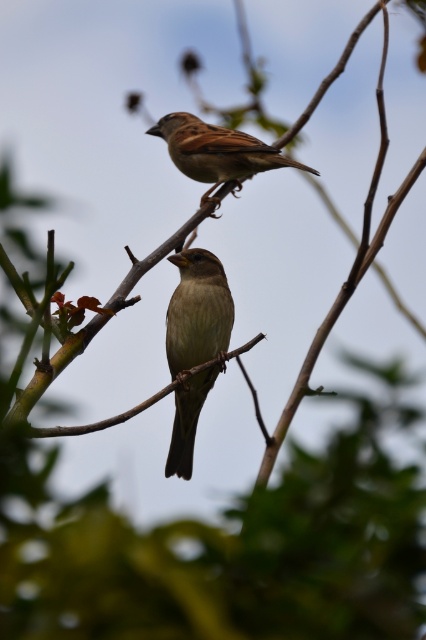
You are observing two brown matte sparrows in a tree. The first is the brown matte sparrow at center, and the second is the brown matte sparrow at upper center. Which of these two birds is positioned to the left of the other?

The brown matte sparrow at center is positioned to the left of the brown matte sparrow at upper center.

You are a birdwatcher trying to identify the two birds in the image. The first bird has a lighter brown plumage with subtle streaks on its chest and a darker tail. The second bird has a more pronounced reddish brown tone on its back and wings. Based on their descriptions, which bird is located at the point coordinates of (195, 344)?

The brown matte sparrow at center is located at point coordinates of (195, 344).

You are a birdwatcher observing the two brown matte sparrows in the image. Which sparrow is closer to you, the brown matte sparrow at center or the brown matte sparrow at upper center?

The brown matte sparrow at center is closer to you because it is in front of the brown matte sparrow at upper center.